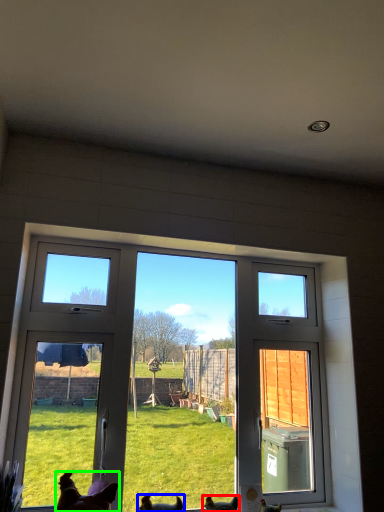
Question: Estimate the real-world distances between objects in this image. Which object is closer to chicken (highlighted by a red box), dog (highlighted by a blue box) or dog (highlighted by a green box)?

Choices:
 (A) dog
 (B) dog

Answer: (A)